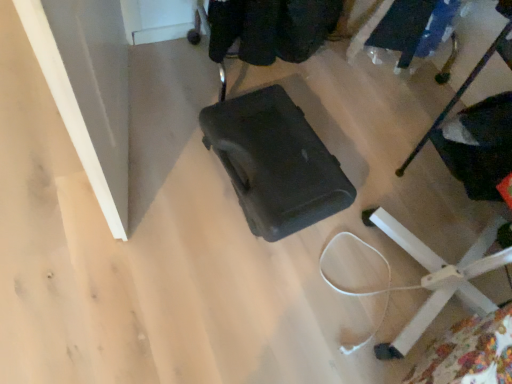
I want to click on vacant point above matte black suitcase at center (from a real-world perspective), so click(x=281, y=157).